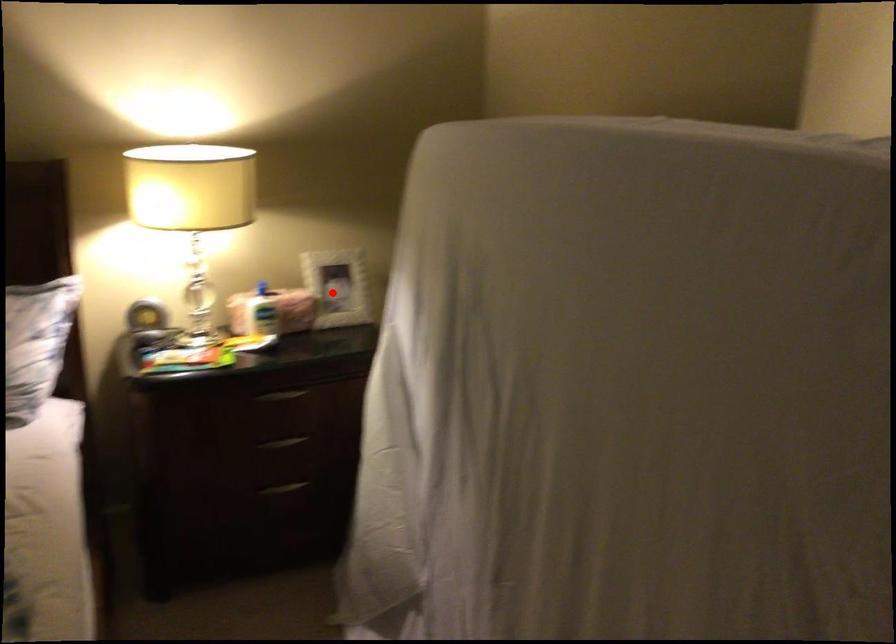
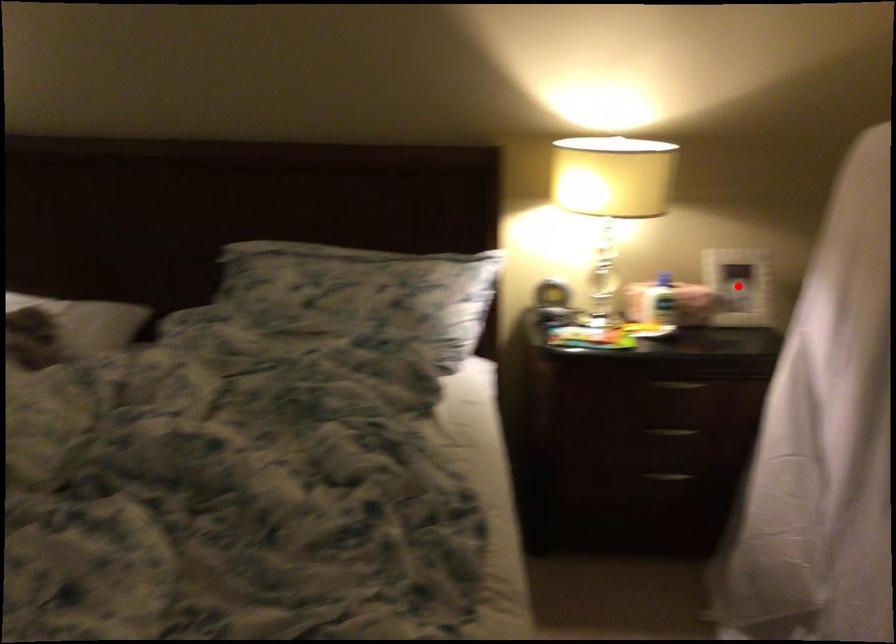
I am providing you with two images of the same scene from different viewpoints. A red point is marked on the first image and another point is marked on the second image. Is the marked point in image1 the same physical position as the marked point in image2?

Yes